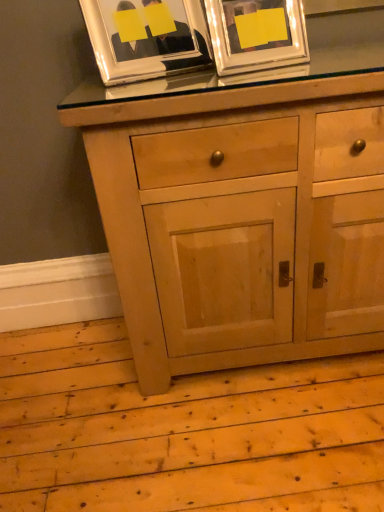
Question: From a real-world perspective, is natural wood cabinet at center positioned above or below metallic silver picture frame at upper center, the first picture frame from the right?

Choices:
 (A) above
 (B) below

Answer: (B)

Question: Is natural wood cabinet at center in front of or behind metallic silver picture frame at upper center, the first picture frame from the right, in the image?

Choices:
 (A) behind
 (B) front

Answer: (B)

Question: Estimate the real-world distances between objects in this image. Which object is farther from the silver metallic picture frame at upper left, the 2th picture frame when ordered from right to left?

Choices:
 (A) natural wood cabinet at center
 (B) metallic silver picture frame at upper center, the first picture frame from the right

Answer: (A)

Question: Which object is the closest to the natural wood cabinet at center?

Choices:
 (A) metallic silver picture frame at upper center, the second picture frame viewed from the left
 (B) silver metallic picture frame at upper left, the 2th picture frame when ordered from right to left

Answer: (A)